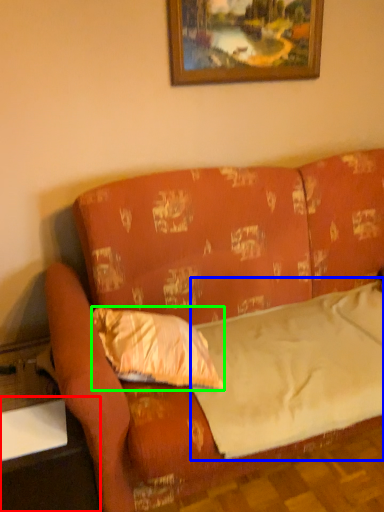
Question: Which object is the farthest from table (highlighted by a red box)? Choose among these: sheet (highlighted by a blue box) or pillow (highlighted by a green box).

Choices:
 (A) sheet
 (B) pillow

Answer: (A)